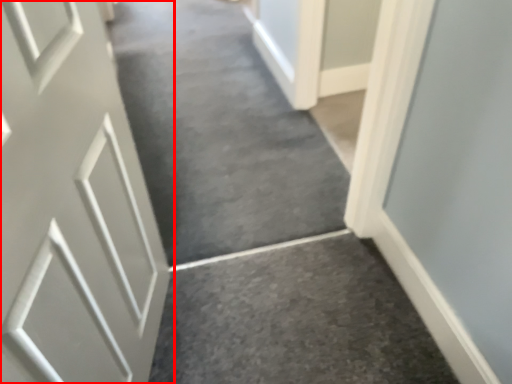
Question: In this image, where is door (annotated by the red box) located relative to aisle?

Choices:
 (A) right
 (B) left

Answer: (A)